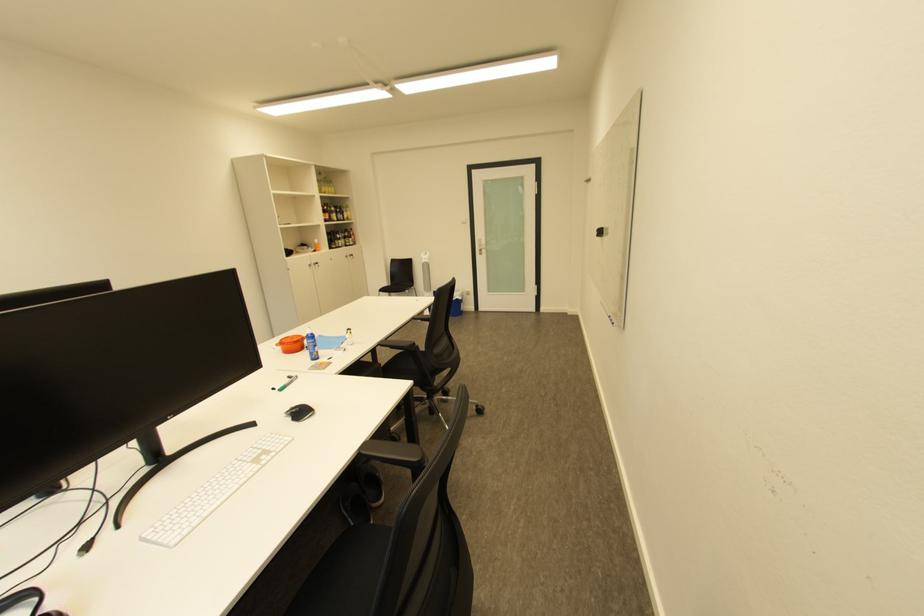
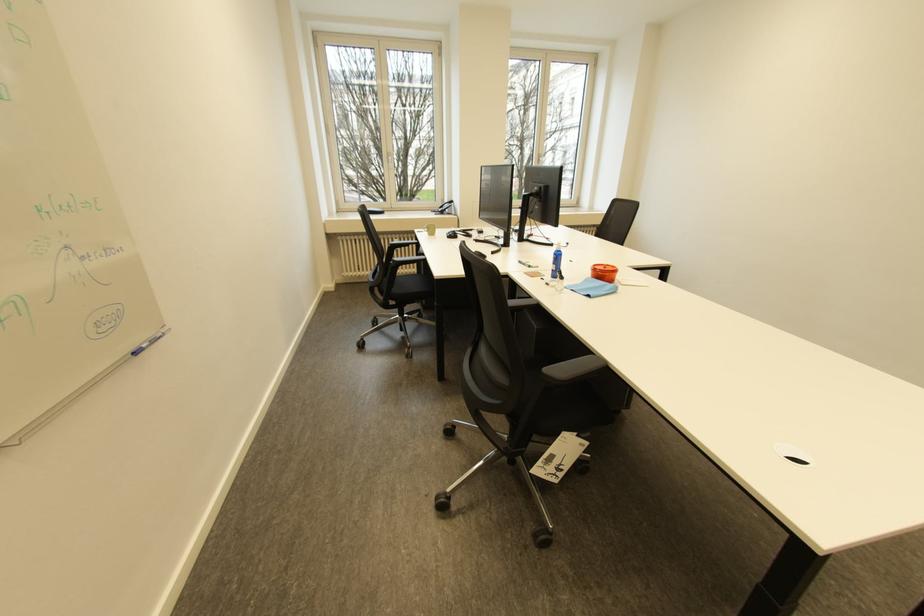
Where in the second image is the point corresponding to pixel 96 548 from the first image?

(483, 241)